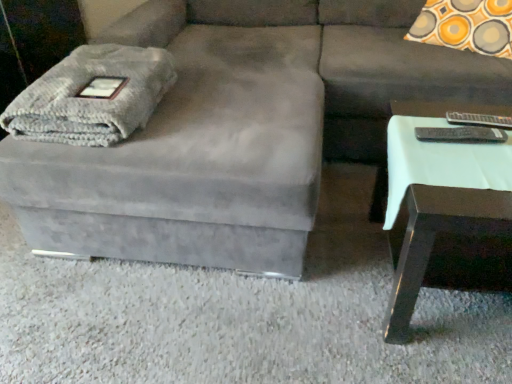
Question: Considering the relative positions of gray knitted blanket at left and orange-yellow circle-patterned pillow at upper right in the image provided, is gray knitted blanket at left to the right of orange-yellow circle-patterned pillow at upper right from the viewer's perspective?

Choices:
 (A) no
 (B) yes

Answer: (A)

Question: Could you tell me if gray knitted blanket at left is turned towards orange-yellow circle-patterned pillow at upper right?

Choices:
 (A) yes
 (B) no

Answer: (B)

Question: Is gray knitted blanket at left at the left side of orange-yellow circle-patterned pillow at upper right?

Choices:
 (A) no
 (B) yes

Answer: (B)

Question: Can you confirm if gray knitted blanket at left is smaller than orange-yellow circle-patterned pillow at upper right?

Choices:
 (A) no
 (B) yes

Answer: (B)

Question: Is orange-yellow circle-patterned pillow at upper right located within gray knitted blanket at left?

Choices:
 (A) yes
 (B) no

Answer: (B)

Question: Is the position of gray knitted blanket at left less distant than that of orange-yellow circle-patterned pillow at upper right?

Choices:
 (A) yes
 (B) no

Answer: (A)

Question: Is orange-yellow circle-patterned pillow at upper right to the left of suede gray couch at center from the viewer's perspective?

Choices:
 (A) yes
 (B) no

Answer: (B)

Question: Is orange-yellow circle-patterned pillow at upper right thinner than suede gray couch at center?

Choices:
 (A) yes
 (B) no

Answer: (A)

Question: Considering the relative sizes of orange-yellow circle-patterned pillow at upper right and suede gray couch at center in the image provided, is orange-yellow circle-patterned pillow at upper right shorter than suede gray couch at center?

Choices:
 (A) no
 (B) yes

Answer: (B)

Question: Does orange-yellow circle-patterned pillow at upper right lie in front of suede gray couch at center?

Choices:
 (A) yes
 (B) no

Answer: (B)

Question: Does orange-yellow circle-patterned pillow at upper right have a greater height compared to suede gray couch at center?

Choices:
 (A) no
 (B) yes

Answer: (A)

Question: Is the position of orange-yellow circle-patterned pillow at upper right more distant than that of suede gray couch at center?

Choices:
 (A) yes
 (B) no

Answer: (A)

Question: Is white glossy side table at right wider than orange-yellow circle-patterned pillow at upper right?

Choices:
 (A) yes
 (B) no

Answer: (B)